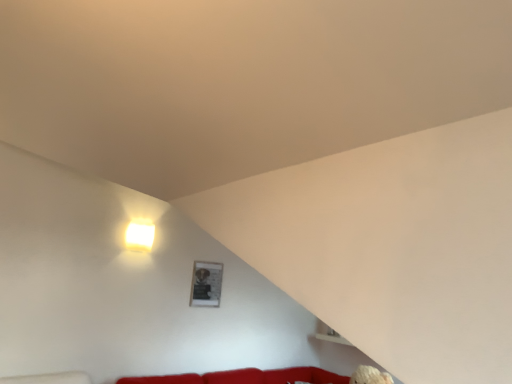
Measure the distance between point (195, 281) and camera.

Point (195, 281) and camera are 4.10 meters apart from each other.

The image size is (512, 384). Describe the element at coordinates (206, 284) in the screenshot. I see `matte black picture frame at upper center` at that location.

Locate an element on the screen. This screenshot has width=512, height=384. matte black picture frame at upper center is located at coordinates (206, 284).

This screenshot has width=512, height=384. What do you see at coordinates (140, 234) in the screenshot?
I see `white glossy square at upper left` at bounding box center [140, 234].

Locate an element on the screen. The width and height of the screenshot is (512, 384). white glossy square at upper left is located at coordinates (140, 234).

Where is `matte black picture frame at upper center`? matte black picture frame at upper center is located at coordinates (206, 284).

In the scene shown: Considering the positions of objects white glossy square at upper left and matte black picture frame at upper center in the image provided, who is more to the left, white glossy square at upper left or matte black picture frame at upper center?

white glossy square at upper left.

Considering their positions, is white glossy square at upper left located in front of or behind matte black picture frame at upper center?

In the image, white glossy square at upper left appears in front of matte black picture frame at upper center.

Between point (146, 229) and point (214, 302), which one is positioned behind?

Positioned behind is point (214, 302).

From the image's perspective, between white glossy square at upper left and matte black picture frame at upper center, who is located below?

From the image's view, matte black picture frame at upper center is below.

From a real-world perspective, is white glossy square at upper left over matte black picture frame at upper center?

Yes, from a real-world perspective, white glossy square at upper left is above matte black picture frame at upper center.

Which of these two, white glossy square at upper left or matte black picture frame at upper center, is wider?

white glossy square at upper left.

Who is taller, white glossy square at upper left or matte black picture frame at upper center?

matte black picture frame at upper center is taller.

Between white glossy square at upper left and matte black picture frame at upper center, which one has smaller size?

matte black picture frame at upper center is smaller.

Do you think white glossy square at upper left is within matte black picture frame at upper center, or outside of it?

white glossy square at upper left lies outside matte black picture frame at upper center.

Are white glossy square at upper left and matte black picture frame at upper center making contact?

No, white glossy square at upper left is not beside matte black picture frame at upper center.

Is white glossy square at upper left positioned with its back to matte black picture frame at upper center?

white glossy square at upper left does not have its back to matte black picture frame at upper center.

How many degrees apart are the facing directions of white glossy square at upper left and matte black picture frame at upper center?

They differ by 1.04 degrees in their facing directions.

How far apart are white glossy square at upper left and matte black picture frame at upper center?

white glossy square at upper left and matte black picture frame at upper center are 25.88 inches apart from each other.

Locate an element on the screen. Image resolution: width=512 pixels, height=384 pixels. picture frame that appears behind the white glossy square at upper left is located at coordinates (206, 284).

Is matte black picture frame at upper center at the right side of white glossy square at upper left?

Indeed, matte black picture frame at upper center is positioned on the right side of white glossy square at upper left.

Which object is closer to the camera, matte black picture frame at upper center or white glossy square at upper left?

white glossy square at upper left is in front.

Which is closer, [212,300] or [138,245]?

Point [212,300].

Based on the photo, from the image's perspective, which is above, matte black picture frame at upper center or white glossy square at upper left?

white glossy square at upper left.

From a real-world perspective, which is physically above, matte black picture frame at upper center or white glossy square at upper left?

white glossy square at upper left is physically above.

Considering the relative sizes of matte black picture frame at upper center and white glossy square at upper left in the image provided, is matte black picture frame at upper center wider than white glossy square at upper left?

In fact, matte black picture frame at upper center might be narrower than white glossy square at upper left.

Does matte black picture frame at upper center have a greater height compared to white glossy square at upper left?

Indeed, matte black picture frame at upper center has a greater height compared to white glossy square at upper left.

Considering the sizes of objects matte black picture frame at upper center and white glossy square at upper left in the image provided, who is smaller, matte black picture frame at upper center or white glossy square at upper left?

With smaller size is matte black picture frame at upper center.

Is matte black picture frame at upper center surrounding white glossy square at upper left?

That's incorrect, white glossy square at upper left is not inside matte black picture frame at upper center.

Is matte black picture frame at upper center with white glossy square at upper left?

No, matte black picture frame at upper center is not in contact with white glossy square at upper left.

Does matte black picture frame at upper center turn towards white glossy square at upper left?

No, matte black picture frame at upper center is not oriented towards white glossy square at upper left.

What's the angular difference between matte black picture frame at upper center and white glossy square at upper left's facing directions?

There is a 1.04-degree angle between the facing directions of matte black picture frame at upper center and white glossy square at upper left.

Measure the distance between matte black picture frame at upper center and white glossy square at upper left.

25.88 inches.

This screenshot has height=384, width=512. What are the coordinates of `picture frame on the right of white glossy square at upper left` in the screenshot? It's located at (206, 284).

Locate an element on the screen. lamp above the matte black picture frame at upper center (from a real-world perspective) is located at coordinates (140, 234).

Find the location of a particular element. lamp located in front of the matte black picture frame at upper center is located at coordinates (140, 234).